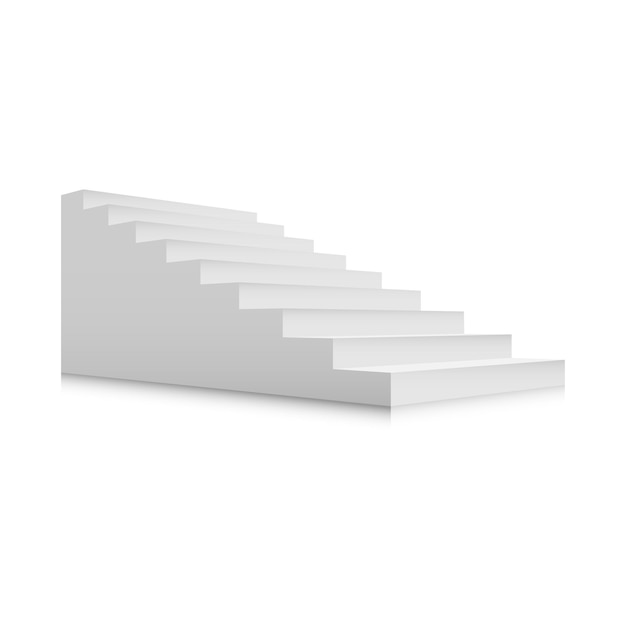
At what (x,y) coordinates should I click in order to perform the action: click on stairs. Please return your answer as a coordinate pair (x, y). The height and width of the screenshot is (626, 626). Looking at the image, I should click on (476, 387), (408, 354), (352, 324), (297, 295), (270, 273), (213, 252), (171, 231), (156, 215), (135, 198).